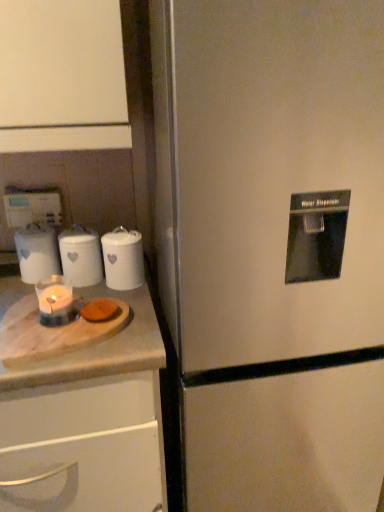
Where is `unoccupied area behind brown matte cookie at lower left`? Image resolution: width=384 pixels, height=512 pixels. unoccupied area behind brown matte cookie at lower left is located at coordinates (117, 290).